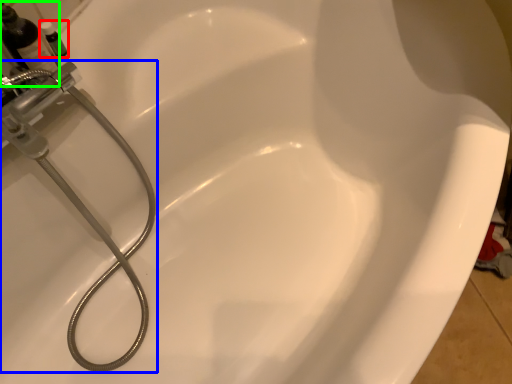
Question: Based on their relative distances, which object is nearer to toiletry (highlighted by a red box)? Choose from plumbing fixture (highlighted by a blue box) and bottle (highlighted by a green box).

Choices:
 (A) plumbing fixture
 (B) bottle

Answer: (B)